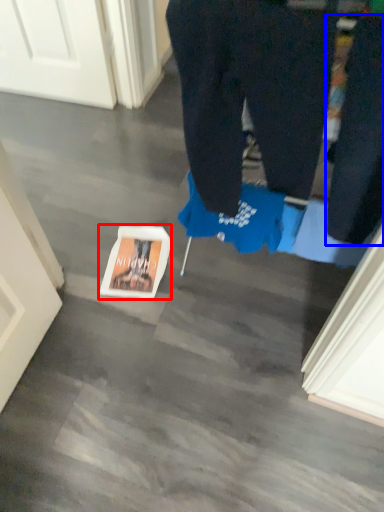
Question: Which point is further to the camera, copy (highlighted by a red box) or pants (highlighted by a blue box)?

Choices:
 (A) copy
 (B) pants

Answer: (A)